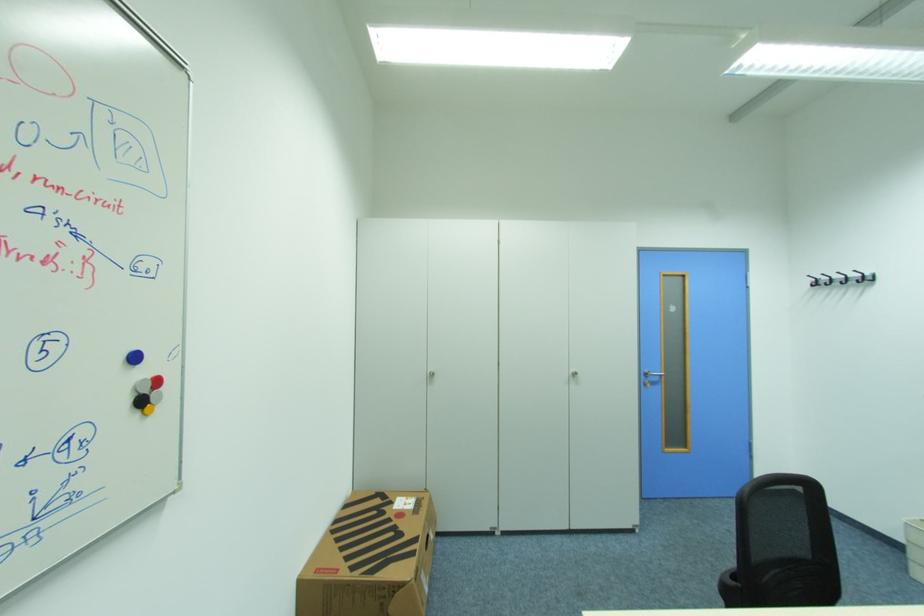
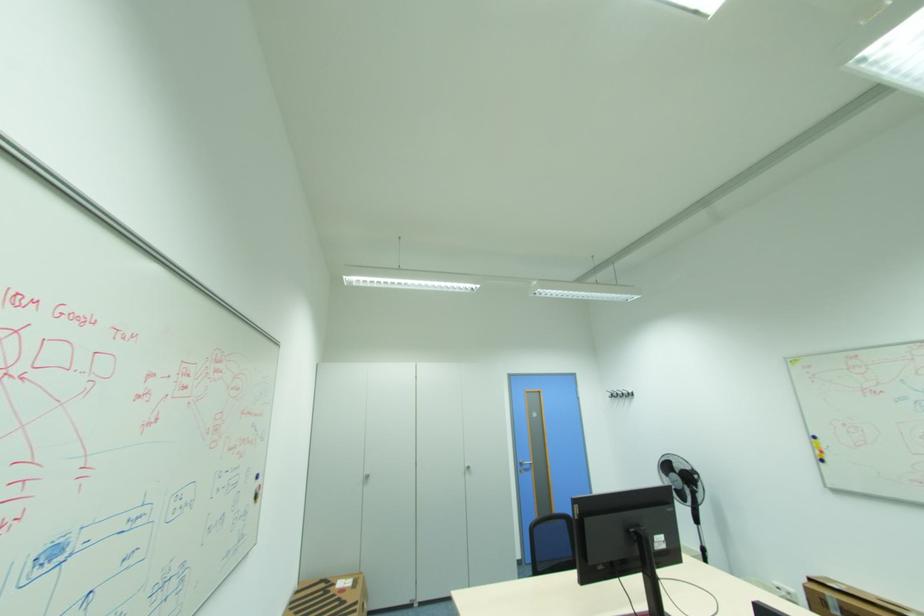
The point at (438, 376) is marked in the first image. Where is the corresponding point in the second image?

(372, 477)